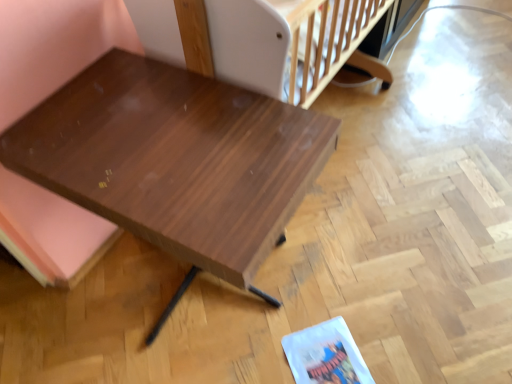
Question: From a real-world perspective, relative to white plastic infant bed at upper center, is shiny brown wood table at center vertically above or below?

Choices:
 (A) below
 (B) above

Answer: (A)

Question: Considering the positions of shiny brown wood table at center and white plastic infant bed at upper center in the image, is shiny brown wood table at center bigger or smaller than white plastic infant bed at upper center?

Choices:
 (A) big
 (B) small

Answer: (A)

Question: Would you say shiny brown wood table at center is inside or outside white plastic infant bed at upper center?

Choices:
 (A) inside
 (B) outside

Answer: (B)

Question: Is white plastic infant bed at upper center in front of or behind shiny brown wood table at center in the image?

Choices:
 (A) front
 (B) behind

Answer: (B)

Question: Considering the positions of white plastic infant bed at upper center and shiny brown wood table at center in the image, is white plastic infant bed at upper center taller or shorter than shiny brown wood table at center?

Choices:
 (A) short
 (B) tall

Answer: (A)

Question: In terms of width, does white plastic infant bed at upper center look wider or thinner when compared to shiny brown wood table at center?

Choices:
 (A) thin
 (B) wide

Answer: (A)

Question: Based on their positions, is white plastic infant bed at upper center located to the left or right of shiny brown wood table at center?

Choices:
 (A) right
 (B) left

Answer: (A)